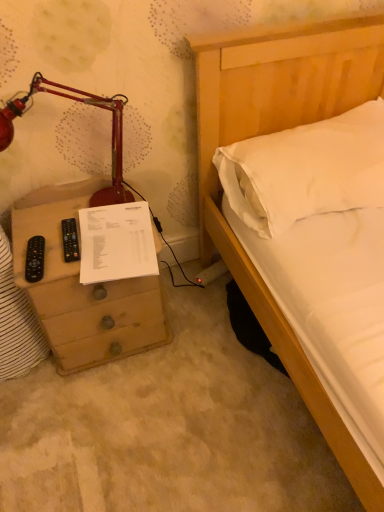
Find the location of a particular element. The width and height of the screenshot is (384, 512). free space in front of black plastic remote at left is located at coordinates (67, 266).